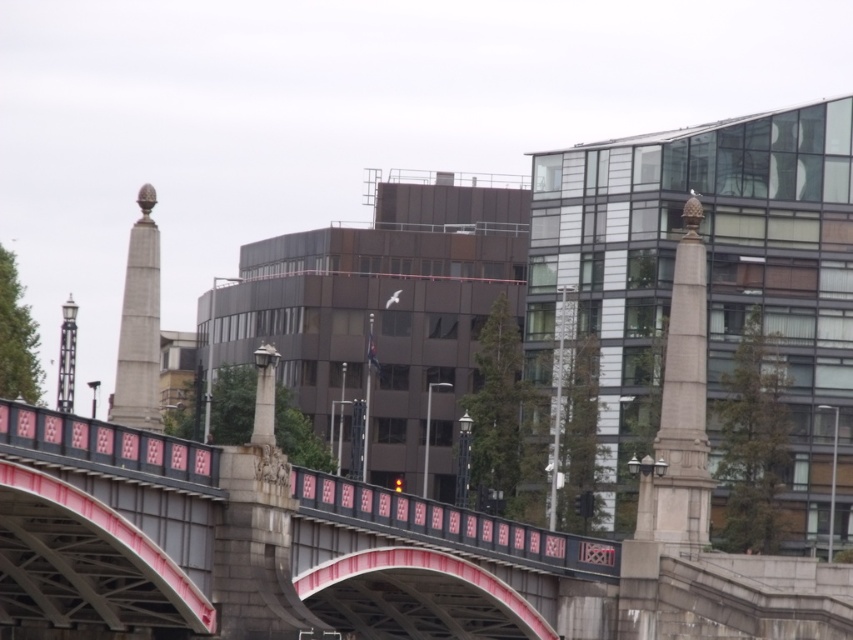
Question: Which point appears closest to the camera in this image?

Choices:
 (A) (131, 310)
 (B) (463, 508)

Answer: (B)

Question: Is metallic bridge at center further to camera compared to smooth stone obelisk at left?

Choices:
 (A) no
 (B) yes

Answer: (A)

Question: Considering the relative positions of metallic bridge at center and smooth stone obelisk at left in the image provided, where is metallic bridge at center located with respect to smooth stone obelisk at left?

Choices:
 (A) left
 (B) right

Answer: (B)

Question: Which of the following is the closest to the observer?

Choices:
 (A) metallic bridge at center
 (B) smooth stone obelisk at left

Answer: (A)

Question: Can you confirm if metallic bridge at center is bigger than smooth stone obelisk at left?

Choices:
 (A) no
 (B) yes

Answer: (B)